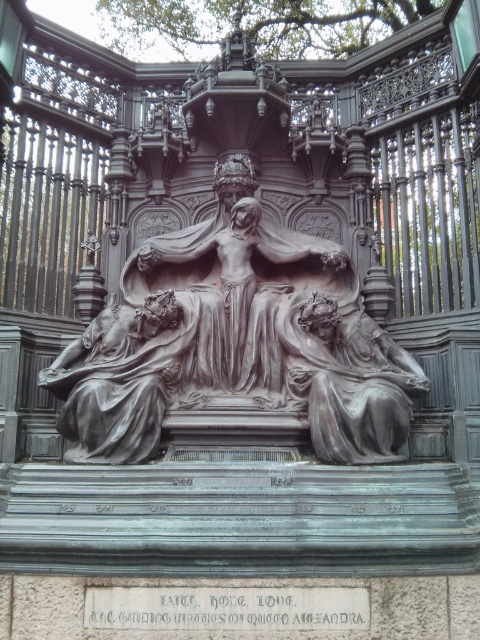
Looking at this image, you are an art conservator assessing the space requirements for transporting two bronze artworks. The polished bronze sculpture at center and the matte bronze statue at center are both displayed in the same architectural structure. Based on their dimensions, which one requires a wider transport container?

The polished bronze sculpture at center requires a wider transport container because its width is larger than that of the matte bronze statue at center.

You are an art conservator tasked with measuring the distance between the polished bronze statue at center and the nearest edge of the architectural structure. Given that the entire structure is represented on a coordinate system where the bottom left corner is the origin point, can you determine if the statue is closer to the left or right edge?

The polished bronze statue at center is positioned at coordinates point (120,380). Since the coordinate system starts at the bottom left corner, the x coordinate of 0.595 indicates its horizontal position. The distance to the left edge would be 0.595, and to the right edge would be 1 minus 0.595, which is 0.405. Therefore, the statue is closer to the right edge.